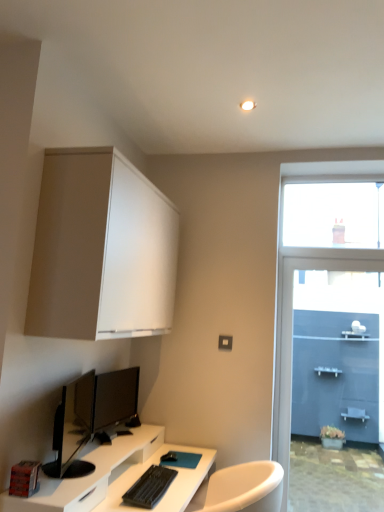
Question: Would you say transparent glass window at upper right is to the left or to the right of matte white cabinet at upper left in the picture?

Choices:
 (A) left
 (B) right

Answer: (B)

Question: From a real-world perspective, relative to matte white cabinet at upper left, is transparent glass window at upper right vertically above or below?

Choices:
 (A) above
 (B) below

Answer: (A)

Question: Based on their relative distances, which object is farther from the black matte keyboard at lower center?

Choices:
 (A) blue matte wall at right
 (B) transparent glass window at upper right
 (C) black glossy monitor at lower left, placed as the first computer monitor when sorted from front to back
 (D) matte white cabinet at upper left
 (E) white glossy desk at lower left

Answer: (B)

Question: Considering the real-world distances, which object is closest to the black matte keyboard at lower center?

Choices:
 (A) black glossy monitor at lower left, placed as the first computer monitor when sorted from front to back
 (B) white glossy desk at lower left
 (C) matte white cabinet at upper left
 (D) blue matte wall at right
 (E) transparent glass window at upper right

Answer: (B)